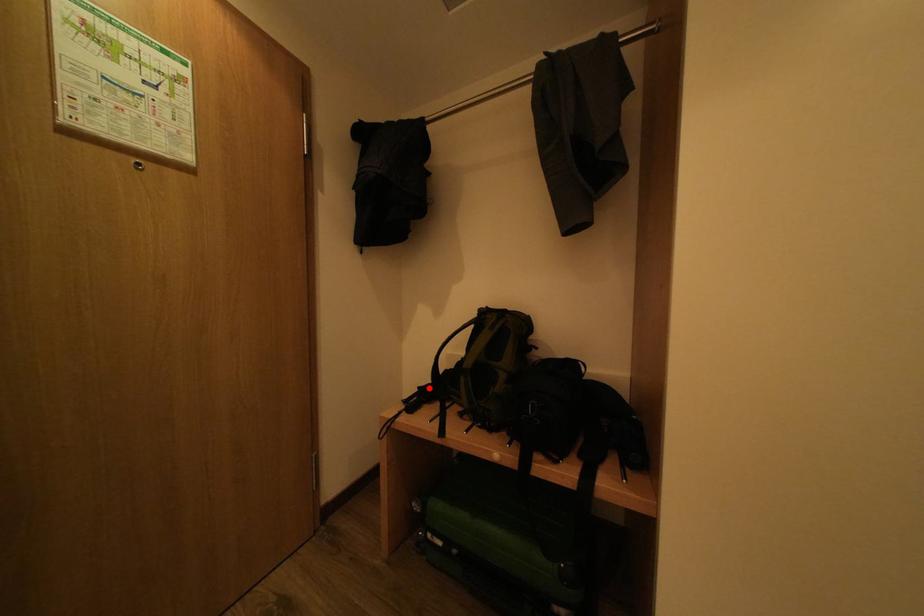
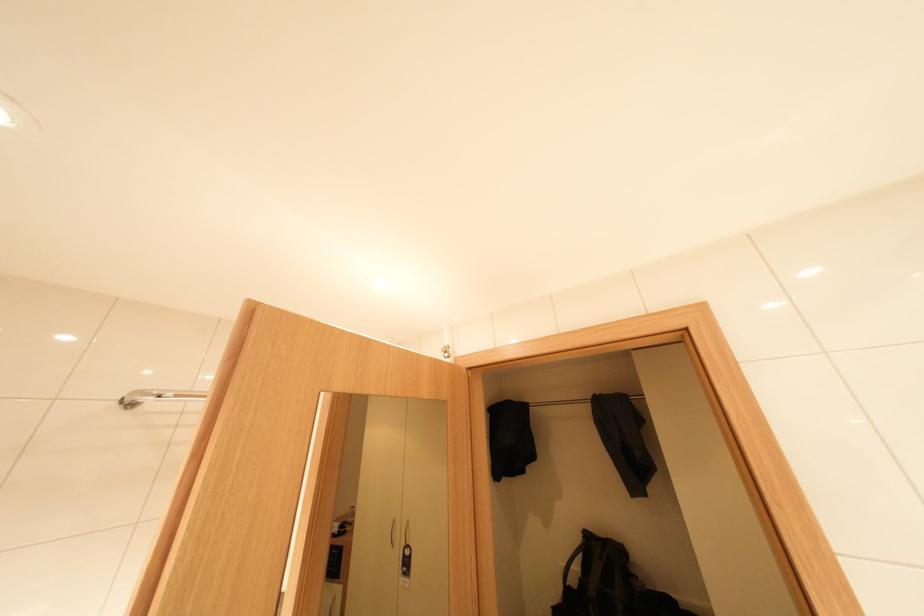
Question: A red point is marked in image1. In image2, is the corresponding 3D point closer to the camera or farther? Reply with the corresponding letter.

Choices:
 (A) The corresponding 3D point is closer.
 (B) The corresponding 3D point is farther.

Answer: (A)